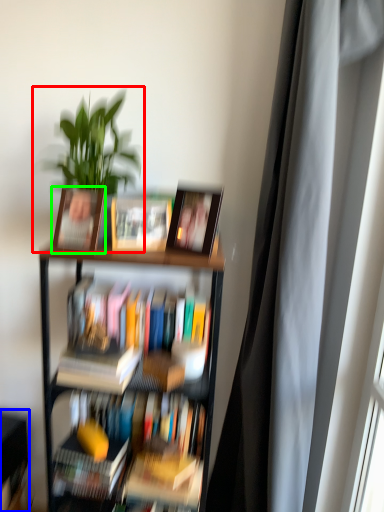
Question: Based on their relative distances, which object is nearer to houseplant (highlighted by a red box)? Choose from shelf (highlighted by a blue box) and picture frame (highlighted by a green box).

Choices:
 (A) shelf
 (B) picture frame

Answer: (B)